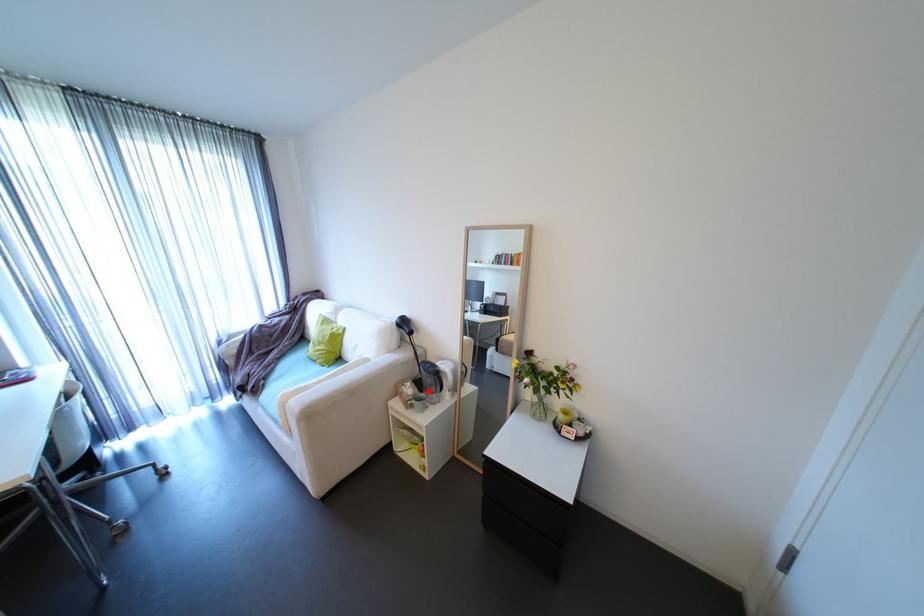
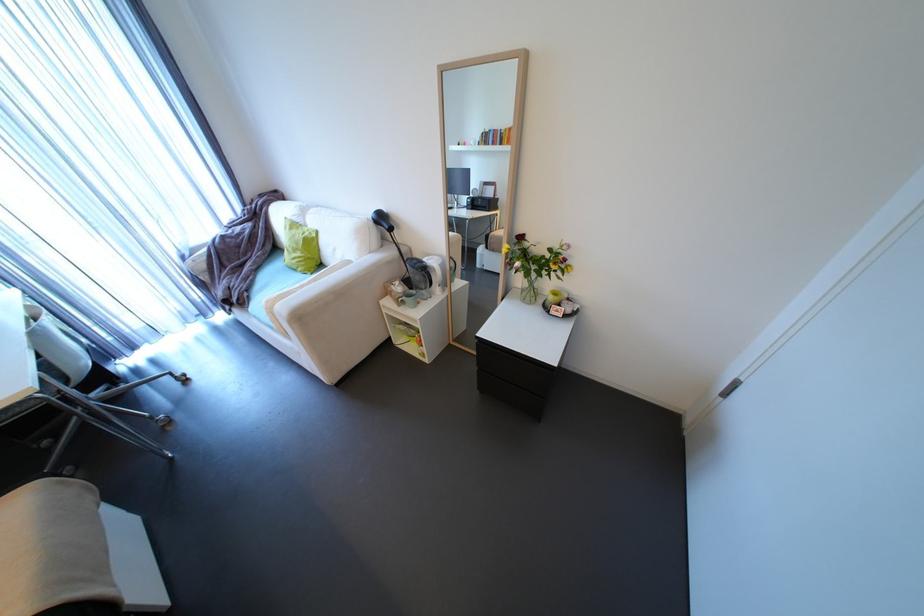
Question: I am providing you with two images of the same scene from different viewpoints. In image1, a red point is highlighted. Considering the same 3D point in image2, which of the following is correct?

Choices:
 (A) It is closer
 (B) It is farther

Answer: (A)